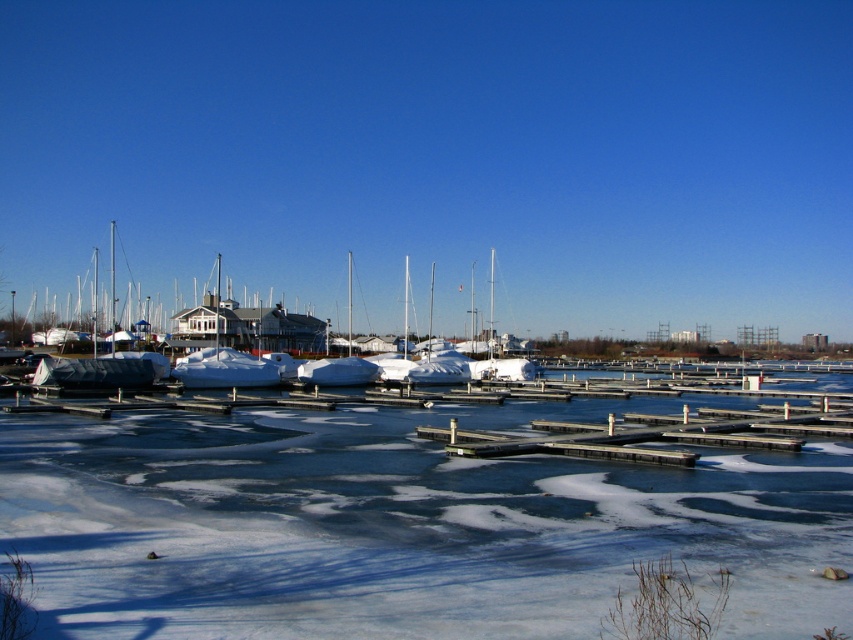
Question: Does white ice at lower center have a lesser width compared to white matte boat at center?

Choices:
 (A) yes
 (B) no

Answer: (A)

Question: Among these points, which one is farthest from the camera?

Choices:
 (A) (223, 515)
 (B) (120, 384)

Answer: (B)

Question: Does white ice at lower center appear under white matte boat at center?

Choices:
 (A) yes
 (B) no

Answer: (A)

Question: Can you confirm if white ice at lower center is positioned above white matte boat at center?

Choices:
 (A) no
 (B) yes

Answer: (A)

Question: Which of the following is the farthest from the observer?

Choices:
 (A) white ice at lower center
 (B) white matte boat at center

Answer: (B)